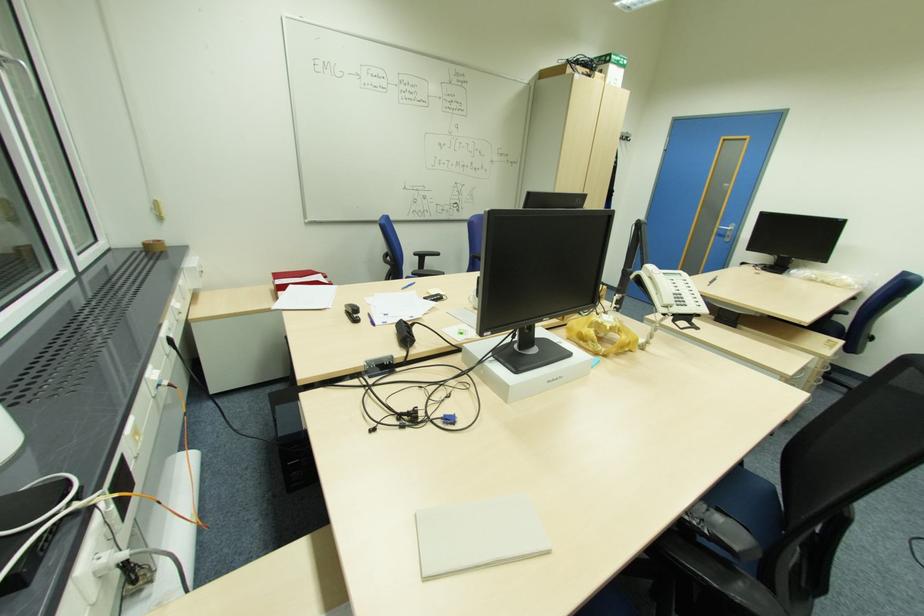
Where would you pull the silver door handle? Please return your answer as a coordinate pair (x, y).

(725, 231)